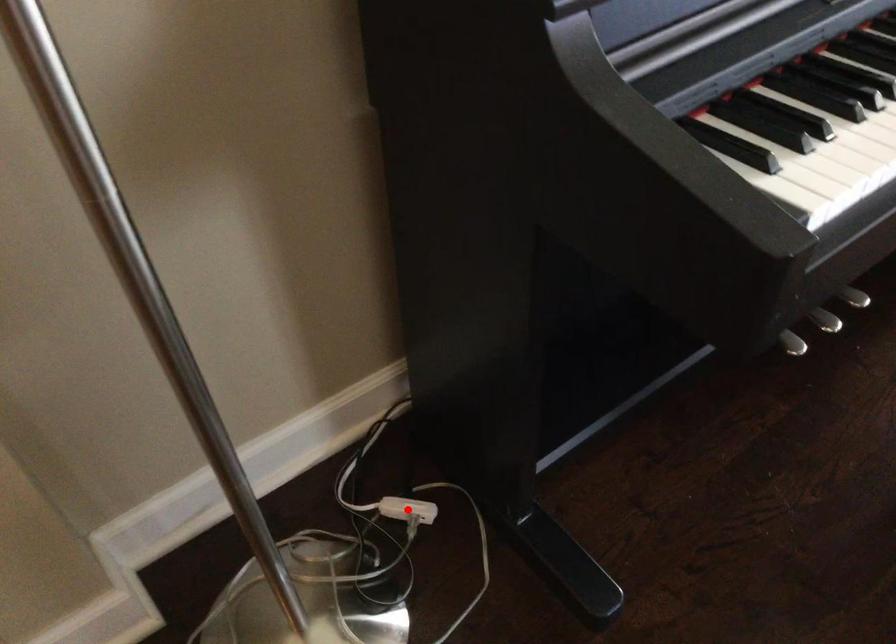
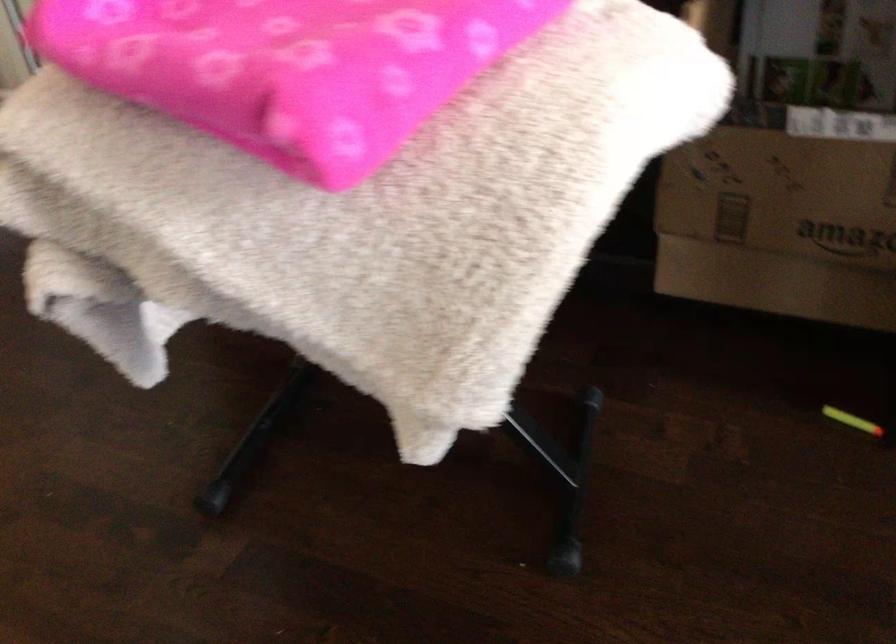
Question: I am providing you with two images of the same scene from different viewpoints. A red point is marked on the first image. At the location where the point appears in image 1, is it still visible in image 2?

Choices:
 (A) Yes
 (B) No

Answer: (B)